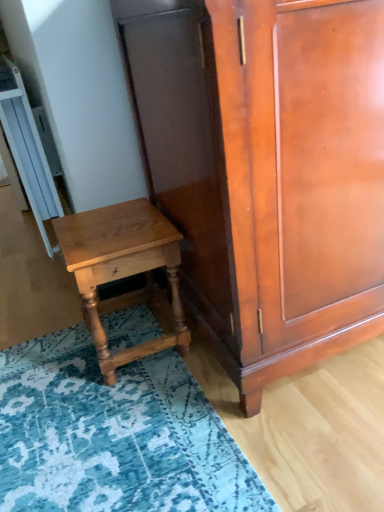
Question: Considering their positions, is shiny brown cabinet at center located in front of or behind blue textured rug at lower left?

Choices:
 (A) front
 (B) behind

Answer: (A)

Question: Considering the positions of point (261, 20) and point (182, 420), is point (261, 20) closer or farther from the camera than point (182, 420)?

Choices:
 (A) farther
 (B) closer

Answer: (B)

Question: Estimate the real-world distances between objects in this image. Which object is closer to the blue textured rug at lower left?

Choices:
 (A) light brown wood nightstand at lower left
 (B) shiny brown cabinet at center

Answer: (A)

Question: Estimate the real-world distances between objects in this image. Which object is closer to the light brown wood nightstand at lower left?

Choices:
 (A) shiny brown cabinet at center
 (B) blue textured rug at lower left

Answer: (B)